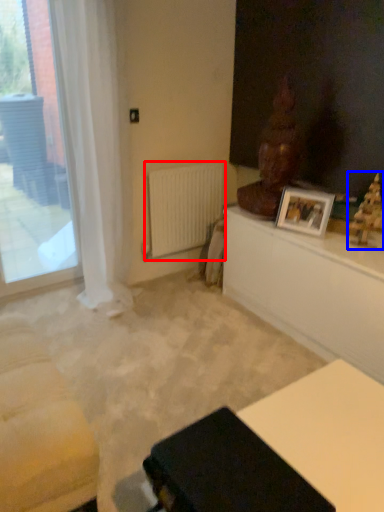
Question: Which object appears closest to the camera in this image, radiator (highlighted by a red box) or sculpture (highlighted by a blue box)?

Choices:
 (A) radiator
 (B) sculpture

Answer: (B)